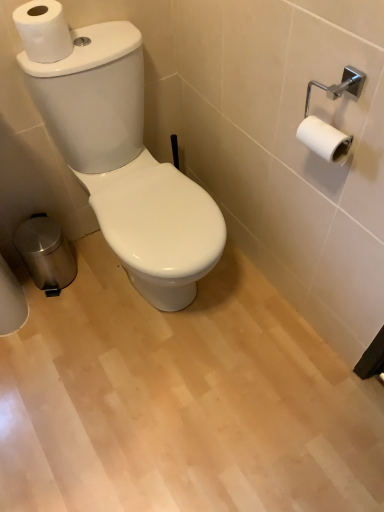
Locate an element on the screen. polished stainless steel trash bin at lower left is located at coordinates (46, 253).

What do you see at coordinates (43, 31) in the screenshot? The image size is (384, 512). I see `white matte toilet paper at upper left` at bounding box center [43, 31].

Identify the location of polished stainless steel trash bin at lower left. [x=46, y=253].

Is white matte toilet paper at upper left to the left or to the right of white glossy toilet at center in the image?

Based on their positions, white matte toilet paper at upper left is located to the left of white glossy toilet at center.

Can you confirm if white matte toilet paper at upper left is shorter than white glossy toilet at center?

Indeed, white matte toilet paper at upper left has a lesser height compared to white glossy toilet at center.

Is white matte toilet paper at upper left aimed at white glossy toilet at center?

No, white matte toilet paper at upper left is not turned towards white glossy toilet at center.

In the scene shown: Is the position of white glossy toilet at center more distant than that of white matte toilet paper at upper left?

No, it is not.

Is point (172, 239) closer or farther from the camera than point (38, 34)?

Point (172, 239).

In terms of height, does white glossy toilet at center look taller or shorter compared to white matte toilet paper at upper left?

In the image, white glossy toilet at center appears to be taller than white matte toilet paper at upper left.

Is polished stainless steel trash bin at lower left bigger than white glossy toilet at center?

No, polished stainless steel trash bin at lower left is not bigger than white glossy toilet at center.

Is polished stainless steel trash bin at lower left to the left of white glossy toilet at center from the viewer's perspective?

Yes.

Which is in front, polished stainless steel trash bin at lower left or white glossy toilet at center?

white glossy toilet at center.

This screenshot has height=512, width=384. I want to click on toilet above the polished stainless steel trash bin at lower left (from a real-world perspective), so click(126, 164).

From the image's perspective, is polished stainless steel trash bin at lower left under white matte toilet paper at upper left?

Yes, from the image's perspective, polished stainless steel trash bin at lower left is beneath white matte toilet paper at upper left.

From the picture: Between polished stainless steel trash bin at lower left and white matte toilet paper at upper left, which one has smaller width?

white matte toilet paper at upper left.

From the image's perspective, does white matte toilet paper at upper left appear higher than polished stainless steel trash bin at lower left?

Yes.

From a real-world perspective, between white matte toilet paper at upper left and polished stainless steel trash bin at lower left, who is vertically higher?

white matte toilet paper at upper left is physically above.

Can you tell me how much white matte toilet paper at upper left and polished stainless steel trash bin at lower left differ in facing direction?

They differ by 25.5 degrees in their facing directions.

Considering the relative positions of white glossy toilet at center and polished stainless steel trash bin at lower left in the image provided, is white glossy toilet at center to the right of polished stainless steel trash bin at lower left from the viewer's perspective?

Yes.

Measure the distance from white glossy toilet at center to polished stainless steel trash bin at lower left.

17.09 inches.

Who is smaller, white glossy toilet at center or polished stainless steel trash bin at lower left?

polished stainless steel trash bin at lower left.

What are the coordinates of `toilet in front of the white matte toilet paper at upper left` in the screenshot? It's located at (126, 164).

Image resolution: width=384 pixels, height=512 pixels. In order to click on toilet lying below the white matte toilet paper at upper left (from the image's perspective) in this screenshot , I will do `click(126, 164)`.

Considering their positions, is white matte toilet paper at upper left positioned closer to polished stainless steel trash bin at lower left than white glossy toilet at center?

The object closer to polished stainless steel trash bin at lower left is white glossy toilet at center.

Considering their positions, is white matte toilet paper at upper left positioned further to white glossy toilet at center than polished stainless steel trash bin at lower left?

polished stainless steel trash bin at lower left is positioned further to the anchor white glossy toilet at center.

Which object lies nearer to the anchor point white matte toilet paper at upper left, white glossy toilet at center or polished stainless steel trash bin at lower left?

white glossy toilet at center is positioned closer to the anchor white matte toilet paper at upper left.

Looking at the image, which one is located closer to polished stainless steel trash bin at lower left, white glossy toilet at center or white matte toilet paper at upper left?

white glossy toilet at center is closer to polished stainless steel trash bin at lower left.

Looking at the image, which one is located further to white glossy toilet at center, polished stainless steel trash bin at lower left or white matte toilet paper at upper left?

Among the two, polished stainless steel trash bin at lower left is located further to white glossy toilet at center.

When comparing their distances from white matte toilet paper at upper left, does polished stainless steel trash bin at lower left or white glossy toilet at center seem closer?

The object closer to white matte toilet paper at upper left is white glossy toilet at center.

Identify the location of toilet paper between white glossy toilet at center and polished stainless steel trash bin at lower left along the z-axis. This screenshot has width=384, height=512. (43, 31).